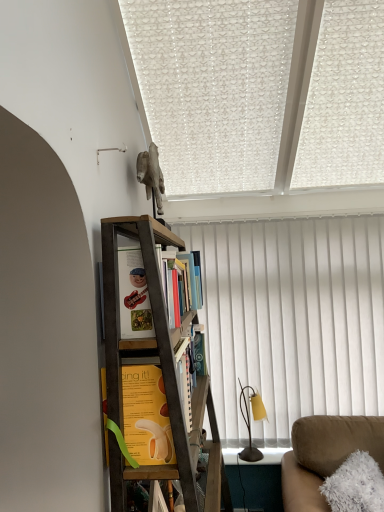
Question: Is hardcover books at center, the 1th book positioned from the top, placed right next to yellow paper at center, which appears as the first book when viewed from the front?

Choices:
 (A) no
 (B) yes

Answer: (A)

Question: Is hardcover books at center, placed as the second book when sorted from bottom to top, in front of yellow paper at center, which is the 2th book in back-to-front order?

Choices:
 (A) no
 (B) yes

Answer: (A)

Question: From a real-world perspective, does hardcover books at center, acting as the 2th book starting from the front, sit lower than yellow paper at center, which is counted as the second book, starting from the top?

Choices:
 (A) yes
 (B) no

Answer: (B)

Question: Does hardcover books at center, marked as the first book in a back-to-front arrangement, contain yellow paper at center, which is the 2th book in back-to-front order?

Choices:
 (A) yes
 (B) no

Answer: (B)

Question: Is hardcover books at center, acting as the 2th book starting from the front, not close to yellow paper at center, which is counted as the second book, starting from the top?

Choices:
 (A) no
 (B) yes

Answer: (A)

Question: Is hardcover books at center, the 1th book positioned from the top, smaller than yellow paper at center, which is counted as the second book, starting from the top?

Choices:
 (A) no
 (B) yes

Answer: (B)

Question: Does yellow paper at center, which is the 2th book in back-to-front order, come behind wooden bookshelf at upper center?

Choices:
 (A) no
 (B) yes

Answer: (A)

Question: From a real-world perspective, is yellow paper at center, which is the 2th book in back-to-front order, over wooden bookshelf at upper center?

Choices:
 (A) yes
 (B) no

Answer: (B)

Question: Is yellow paper at center, which is the 2th book in back-to-front order, in front of wooden bookshelf at upper center?

Choices:
 (A) yes
 (B) no

Answer: (A)

Question: Would you say yellow paper at center, which appears as the first book when viewed from the front, contains wooden bookshelf at upper center?

Choices:
 (A) yes
 (B) no

Answer: (B)

Question: Is yellow paper at center, which appears as the first book when viewed from the front, shorter than wooden bookshelf at upper center?

Choices:
 (A) no
 (B) yes

Answer: (A)

Question: Is yellow paper at center, which is the 2th book in back-to-front order, positioned far away from wooden bookshelf at upper center?

Choices:
 (A) yes
 (B) no

Answer: (B)

Question: Is hardcover books at center, marked as the first book in a back-to-front arrangement, shorter than metallic yellow table lamp at right?

Choices:
 (A) yes
 (B) no

Answer: (A)